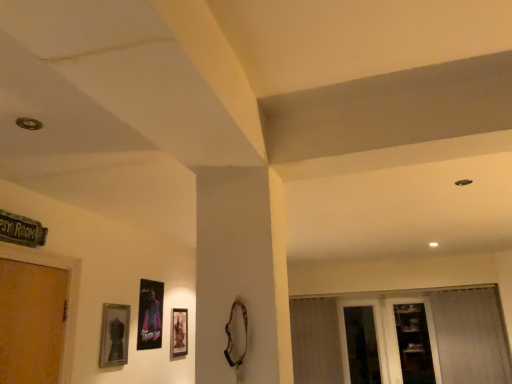
Question: From a real-world perspective, is metallic poster at center, the second picture frame when ordered from back to front, positioned above or below wooden shelf at lower right?

Choices:
 (A) above
 (B) below

Answer: (A)

Question: Considering the positions of metallic poster at center, which appears as the second picture frame when viewed from the front, and wooden shelf at lower right in the image, is metallic poster at center, which appears as the second picture frame when viewed from the front, wider or thinner than wooden shelf at lower right?

Choices:
 (A) wide
 (B) thin

Answer: (B)

Question: Considering the real-world distances, which object is closest to the metallic poster at center, which appears as the second picture frame when viewed from the front?

Choices:
 (A) matte black picture frame at lower center, the third picture frame positioned from the left
 (B) transparent glass door at lower right
 (C) matte silver picture frame at lower left, the 3th picture frame positioned from the right
 (D) wooden shelf at lower right
 (E) white sheer curtain at right

Answer: (C)

Question: Estimate the real-world distances between objects in this image. Which object is closer to the transparent glass door at lower right?

Choices:
 (A) metallic poster at center, positioned as the second picture frame in left-to-right order
 (B) wooden shelf at lower right
 (C) transparent glass screen door at lower right
 (D) white sheer curtain at right
 (E) matte black picture frame at lower center, which is the third picture frame from front to back

Answer: (B)